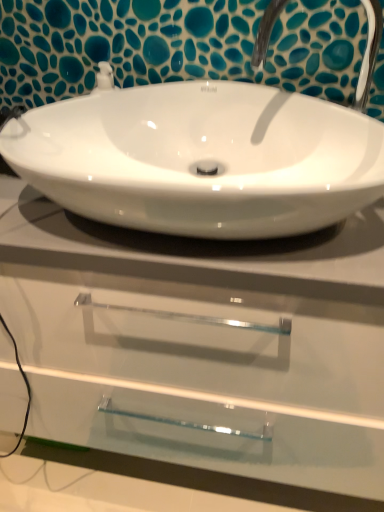
Identify the location of white glossy countertop at center. This screenshot has height=512, width=384. (203, 352).

Based on their sizes in the image, would you say white glossy sink at center is bigger or smaller than satin nickel faucet at upper center?

Considering their sizes, white glossy sink at center takes up more space than satin nickel faucet at upper center.

Is white glossy sink at center outside of satin nickel faucet at upper center?

Yes.

Which object is closer to the camera, white glossy sink at center or satin nickel faucet at upper center?

white glossy sink at center is closer to the camera.

Does point (99, 124) come behind point (376, 4)?

Yes, point (99, 124) is farther from viewer.

Based on their positions, is white glossy countertop at center located to the left or right of white glossy sink at center?

Based on their positions, white glossy countertop at center is located to the left of white glossy sink at center.

Does white glossy countertop at center have a larger size compared to white glossy sink at center?

Indeed, white glossy countertop at center has a larger size compared to white glossy sink at center.

Looking at this image, is white glossy countertop at center next to white glossy sink at center and touching it?

No, white glossy countertop at center is not in contact with white glossy sink at center.

Who is more distant, white glossy countertop at center or white glossy sink at center?

white glossy countertop at center is further away from the camera.

Would you say satin nickel faucet at upper center is a long distance from white glossy countertop at center?

No.

Which object is positioned more to the left, satin nickel faucet at upper center or white glossy countertop at center?

Positioned to the left is white glossy countertop at center.

You are a GUI agent. You are given a task and a screenshot of the screen. Output one action in this format:
    pyautogui.click(x=<x>, y=<y>)
    Task: Click on the plumbing fixture that is on the right side of white glossy countertop at center
    The height and width of the screenshot is (512, 384).
    Given the screenshot: What is the action you would take?
    pyautogui.click(x=369, y=52)

Between satin nickel faucet at upper center and white glossy countertop at center, which one has smaller width?

With smaller width is satin nickel faucet at upper center.

Which of these two, white glossy countertop at center or satin nickel faucet at upper center, is bigger?

white glossy countertop at center is bigger.

Does point (93, 366) come farther from viewer compared to point (258, 30)?

Yes, it is.

From the image's perspective, which is below, white glossy countertop at center or satin nickel faucet at upper center?

white glossy countertop at center.

Which object is more forward, satin nickel faucet at upper center or white glossy sink at center?

white glossy sink at center.

Between satin nickel faucet at upper center and white glossy sink at center, which one has larger width?

white glossy sink at center is wider.

Who is smaller, satin nickel faucet at upper center or white glossy sink at center?

satin nickel faucet at upper center.

Would you say white glossy sink at center is part of satin nickel faucet at upper center's contents?

No, white glossy sink at center is not surrounded by satin nickel faucet at upper center.

How distant is white glossy sink at center from white glossy countertop at center?

A distance of 9.73 inches exists between white glossy sink at center and white glossy countertop at center.

Based on their sizes in the image, would you say white glossy sink at center is bigger or smaller than white glossy countertop at center?

Considering their sizes, white glossy sink at center takes up less space than white glossy countertop at center.

Is white glossy sink at center spatially inside white glossy countertop at center, or outside of it?

white glossy sink at center lies outside white glossy countertop at center.

You are a GUI agent. You are given a task and a screenshot of the screen. Output one action in this format:
    pyautogui.click(x=<x>, y=<y>)
    Task: Click on the sink below the satin nickel faucet at upper center (from the image's perspective)
    This screenshot has height=512, width=384.
    Given the screenshot: What is the action you would take?
    pyautogui.click(x=205, y=154)

This screenshot has height=512, width=384. In order to click on sink lying in front of the white glossy countertop at center in this screenshot , I will do `click(205, 154)`.

Considering their positions, is white glossy sink at center positioned closer to satin nickel faucet at upper center than white glossy countertop at center?

Based on the image, white glossy sink at center appears to be nearer to satin nickel faucet at upper center.

Based on their spatial positions, is white glossy sink at center or satin nickel faucet at upper center closer to white glossy countertop at center?

white glossy sink at center lies closer to white glossy countertop at center than the other object.

Based on their spatial positions, is white glossy countertop at center or white glossy sink at center closer to satin nickel faucet at upper center?

white glossy sink at center.

Estimate the real-world distances between objects in this image. Which object is further from white glossy countertop at center, satin nickel faucet at upper center or white glossy sink at center?

Among the two, satin nickel faucet at upper center is located further to white glossy countertop at center.

Considering their positions, is white glossy countertop at center positioned further to white glossy sink at center than satin nickel faucet at upper center?

The object further to white glossy sink at center is white glossy countertop at center.

Considering their positions, is satin nickel faucet at upper center positioned further to white glossy sink at center than white glossy countertop at center?

white glossy countertop at center.

At what (x,y) coordinates should I click in order to perform the action: click on sink between satin nickel faucet at upper center and white glossy countertop at center vertically. Please return your answer as a coordinate pair (x, y). This screenshot has width=384, height=512. Looking at the image, I should click on (205, 154).